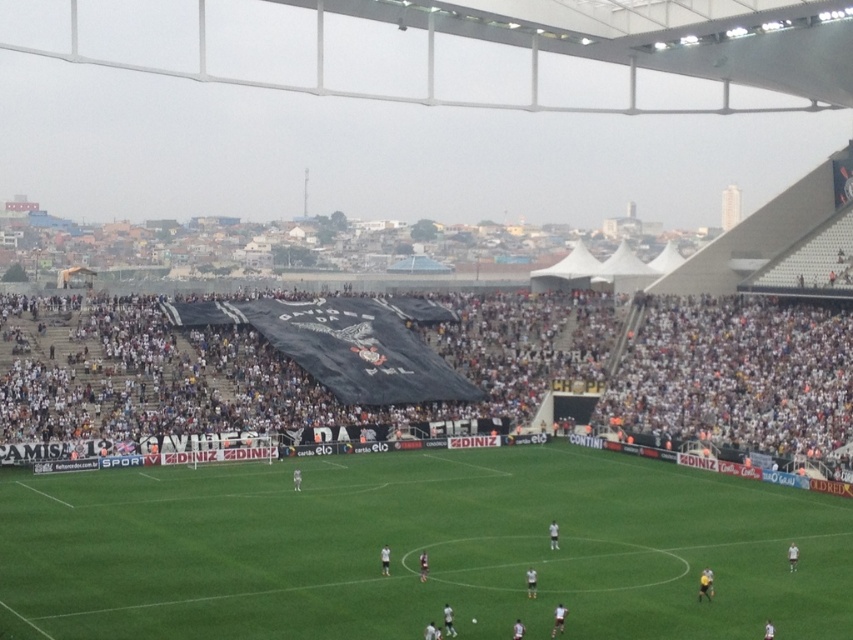
Can you confirm if green grass football field at center is positioned below black fabric banner at center?

Yes.

Between green grass football field at center and black fabric banner at center, which one appears on the right side from the viewer's perspective?

black fabric banner at center is more to the right.

Is point (254, 557) in front of point (280, 362)?

That is True.

Where is `green grass football field at center`? Image resolution: width=853 pixels, height=640 pixels. green grass football field at center is located at coordinates (418, 548).